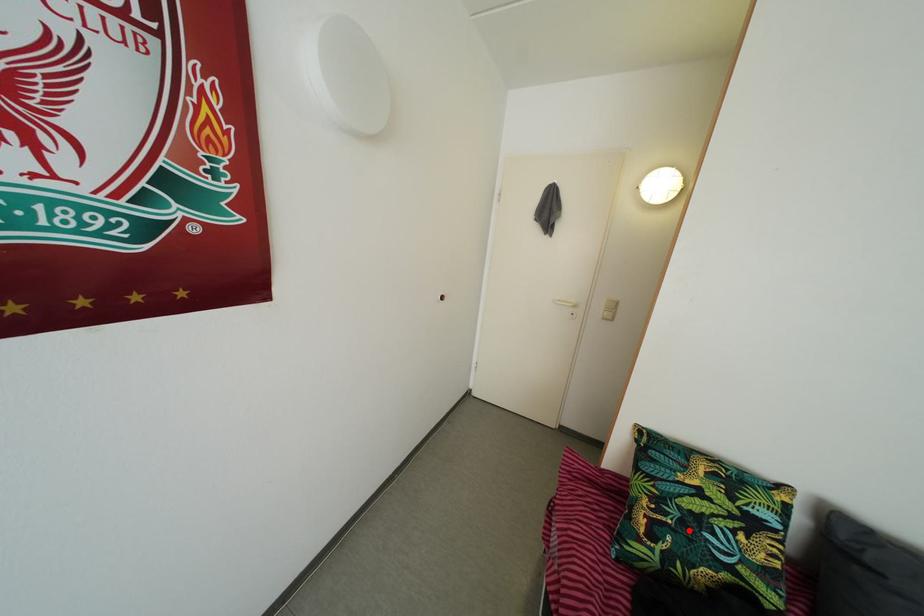
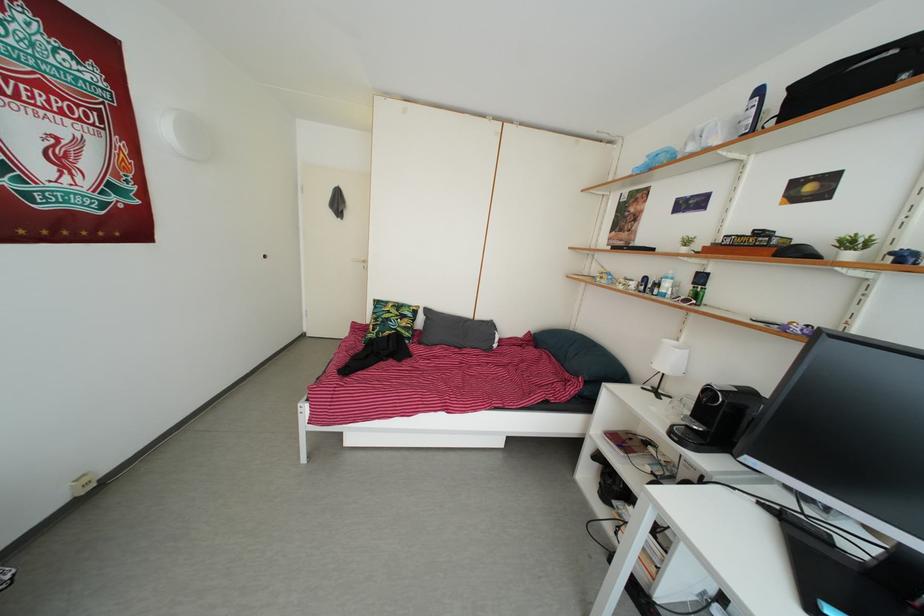
The point at the highlighted location is marked in the first image. Where is the corresponding point in the second image?

(388, 330)